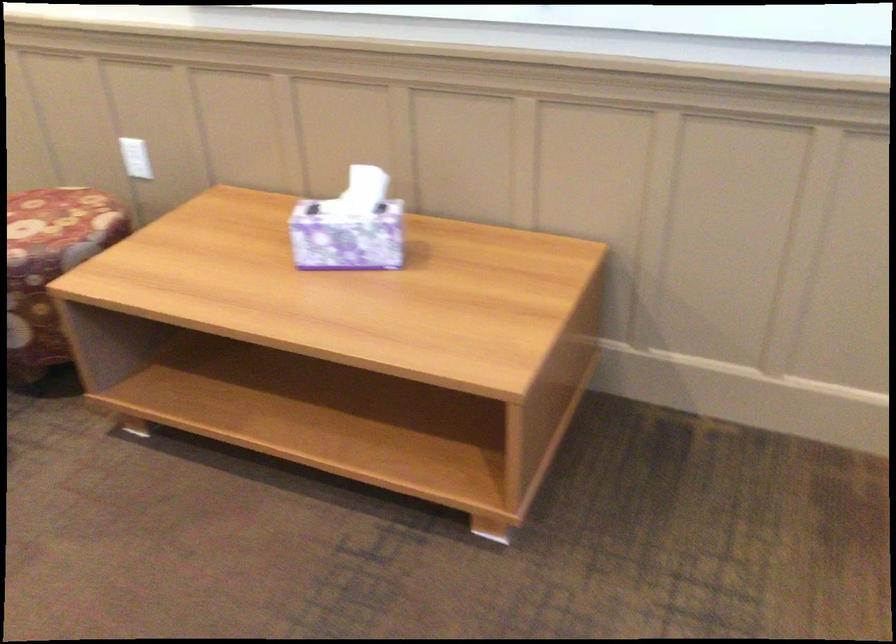
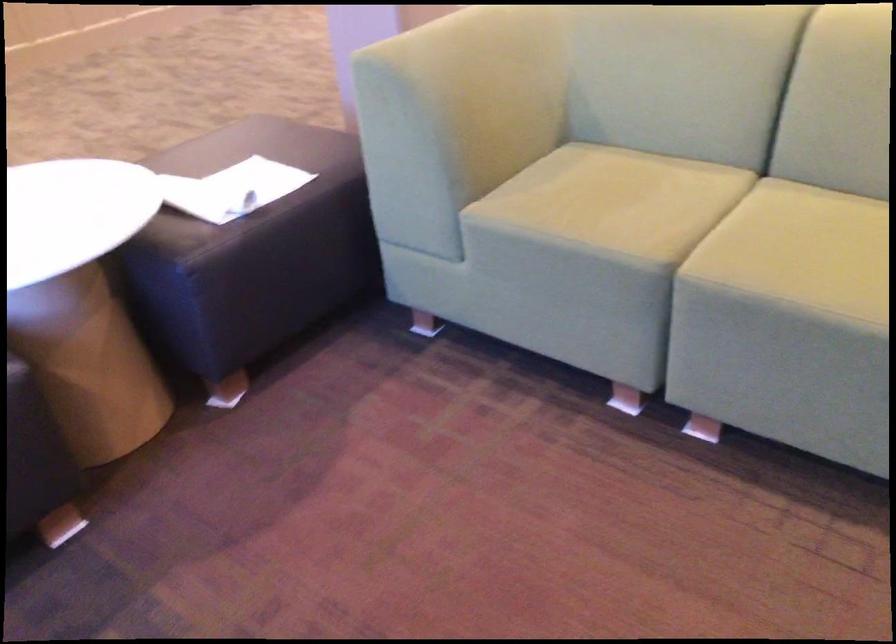
The images are taken continuously from a first-person perspective. In which direction is your viewpoint rotating?

The camera rotated toward left-down.